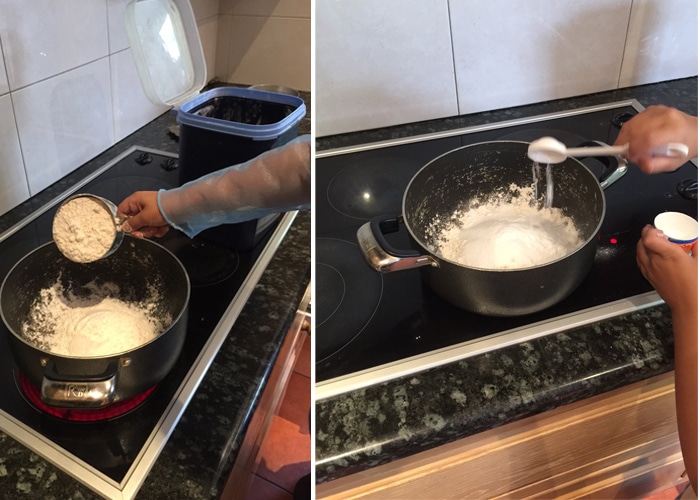
This screenshot has height=500, width=700. What are the coordinates of `stove` in the screenshot? It's located at (602, 127).